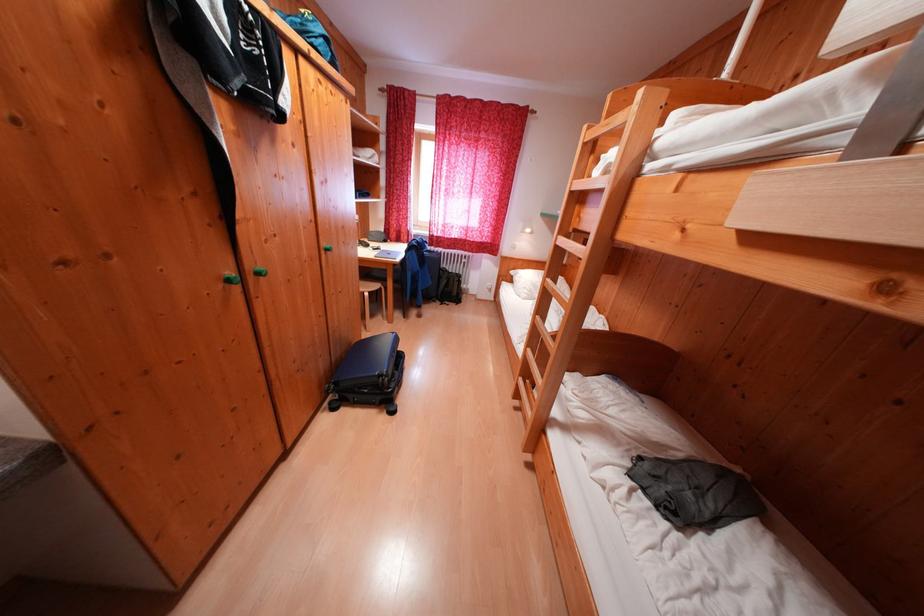
Where would you lift the blue suitcase? Please return your answer as a coordinate pair (x, y).

(369, 373)